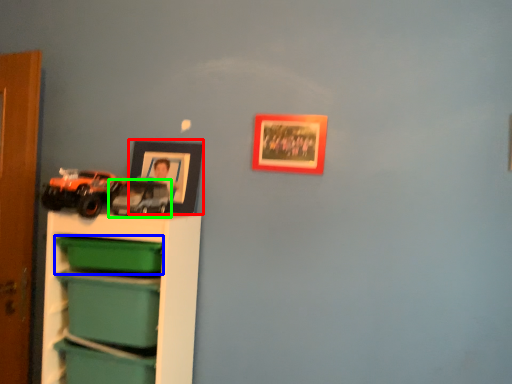
Question: Considering the real-world distances, which object is closest to picture frame (highlighted by a red box)? storage box (highlighted by a blue box) or toy (highlighted by a green box).

Choices:
 (A) storage box
 (B) toy

Answer: (B)